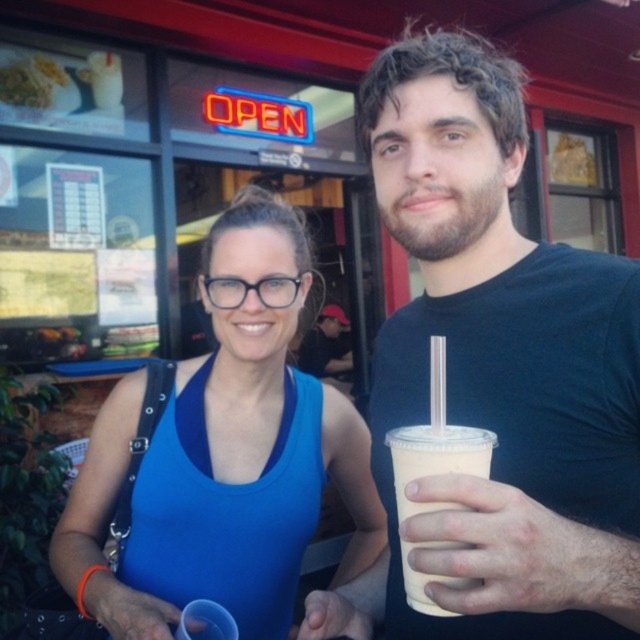
You are a customer at the store and want to place your black matte cup at center onto the white glossy plate at upper left. Is this possible based on their positions?

The black matte cup at center is to the right of white glossy plate at upper left, so placing the cup onto the plate would require moving it to the left, but since the plate is at upper left and the cup is at center, their positions might not align for placement. However, the question of physical possibility isn

You are a photographer trying to capture a closeup shot of both the black matte cup at center and the blue fabric tank top at center. Given that your camera has a minimum focus distance of 12 inches, will you be able to focus on both objects simultaneously?

The black matte cup at center and blue fabric tank top at center are 11.83 inches apart, which is less than the camera minimum focus distance of 12 inches. Therefore, the camera cannot focus on both objects simultaneously.

You are a delivery person who needs to place a package between the black matte cup at center and the white glossy plate at upper left. The package requires a minimum of 10 feet of space between them. Can you safely place the package there?

The black matte cup at center is 9.09 feet from the white glossy plate at upper left, which is less than the required 10 feet. Therefore, you cannot safely place the package there.